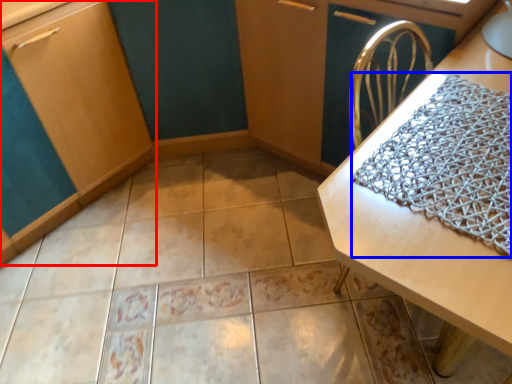
Question: Among these objects, which one is nearest to the camera, cabinetry (highlighted by a red box) or blanket (highlighted by a blue box)?

Choices:
 (A) cabinetry
 (B) blanket

Answer: (B)